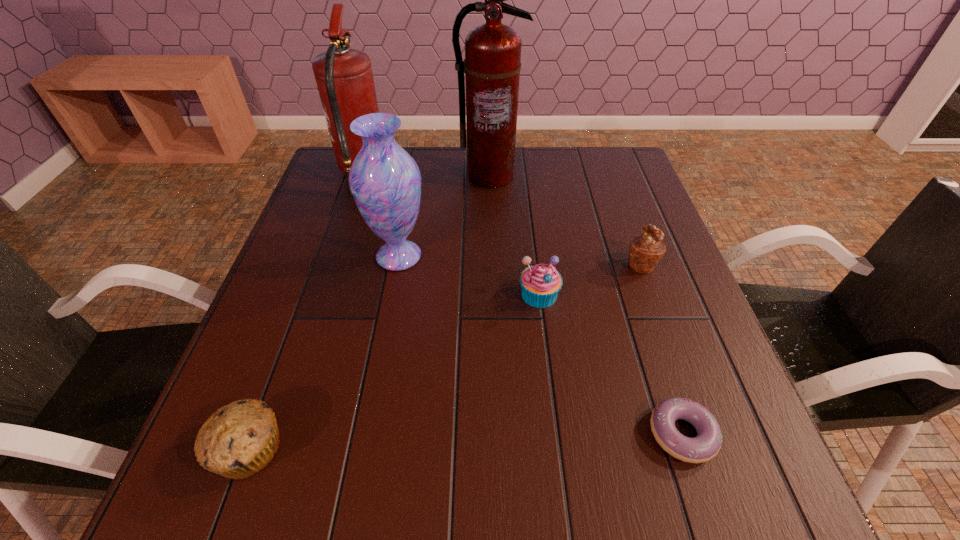
Where is `muffin that is positioned at the right edge`? Image resolution: width=960 pixels, height=540 pixels. muffin that is positioned at the right edge is located at coordinates (646, 250).

Where is `doughnut present at the right edge`? doughnut present at the right edge is located at coordinates (707, 443).

Identify the location of object that is at the far left corner. This screenshot has height=540, width=960. (344, 77).

Locate an element on the screen. object located in the near left corner section of the desktop is located at coordinates (238, 440).

Locate an element on the screen. This screenshot has width=960, height=540. object located at the near right corner is located at coordinates (707, 443).

Locate an element on the screen. free space at the far edge is located at coordinates (564, 187).

You are a GUI agent. You are given a task and a screenshot of the screen. Output one action in this format:
    pyautogui.click(x=<x>, y=<y>)
    Task: Click on the vacant region at the near edge
    This screenshot has width=960, height=540.
    Given the screenshot: What is the action you would take?
    pyautogui.click(x=353, y=514)

Identify the location of vacant region at the left edge of the desktop. The height and width of the screenshot is (540, 960). (312, 357).

Image resolution: width=960 pixels, height=540 pixels. What are the coordinates of `vacant space at the right edge of the desktop` in the screenshot? It's located at click(726, 375).

The width and height of the screenshot is (960, 540). Find the location of `vacant space at the near left corner of the desktop`. vacant space at the near left corner of the desktop is located at coordinates (292, 459).